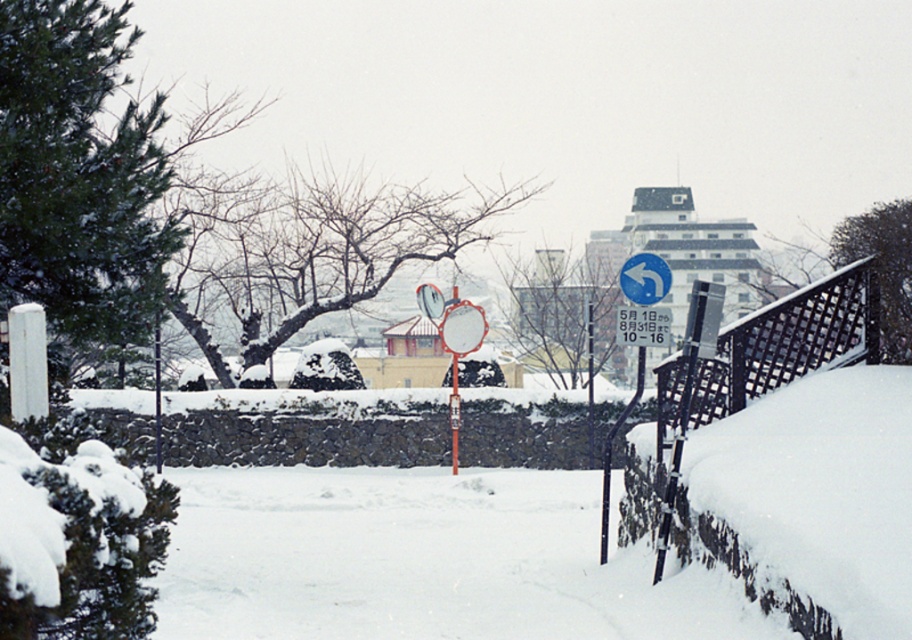
You are a delivery person trying to locate the entrance to the building. You see a blue circular sign at upper right and a blue plastic sign at upper center. Which sign is closer to you?

The blue circular sign at upper right is in front of the blue plastic sign at upper center, so it is closer to you.

You are a delivery person trying to locate the entrance to the building. You see the blue circular sign at upper right and the blue plastic sign at upper center. Which sign is closer to the building entrance?

The blue circular sign at upper right is to the right of the blue plastic sign at upper center, so the blue plastic sign at upper center is closer to the building entrance.